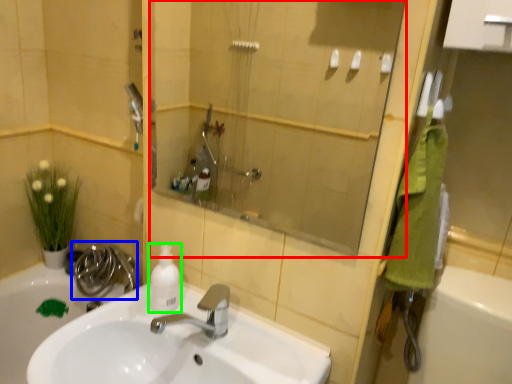
Question: Considering the real-world distances, which object is closest to mirror (highlighted by a red box)? plumbing fixture (highlighted by a blue box) or cleaning product (highlighted by a green box).

Choices:
 (A) plumbing fixture
 (B) cleaning product

Answer: (A)